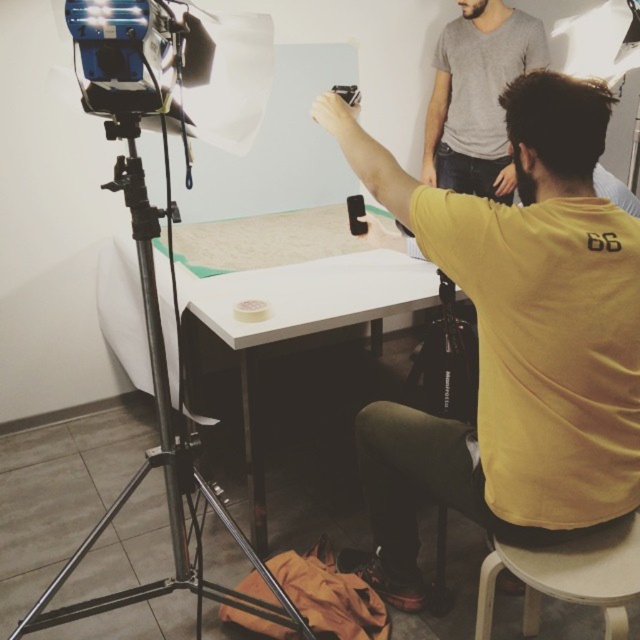
Consider the image. You are a photographer setting up a shoot. You have a white matte table at center and a white plastic stool at lower right. You need to place a 1 meter long equipment bag between them. Will there be enough space?

The white matte table at center and white plastic stool at lower right are 1.14 meters apart, so placing a 1 meter long equipment bag between them will fit since the distance is greater than the bag length.